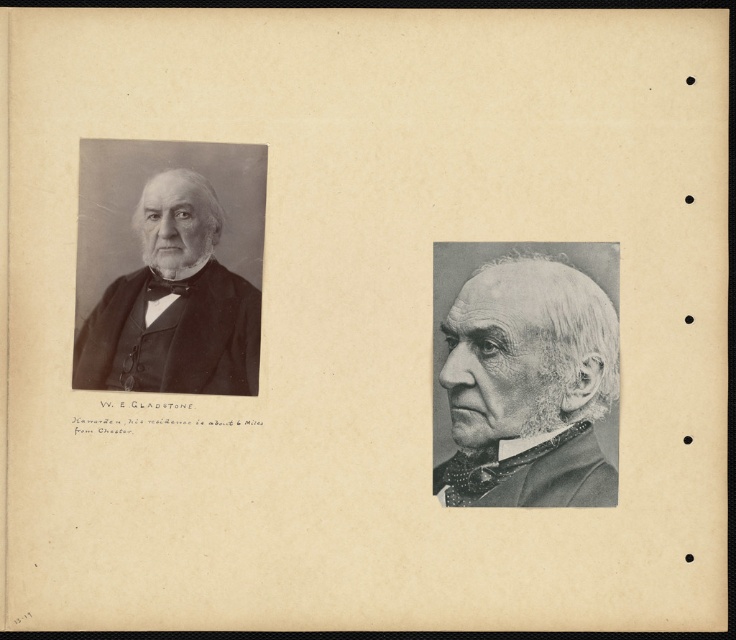
Question: Is gray matte suit at center positioned before matte black bow tie at left?

Choices:
 (A) no
 (B) yes

Answer: (B)

Question: Which point is farther to the camera?

Choices:
 (A) (149, 228)
 (B) (452, 381)

Answer: (A)

Question: Is gray matte suit at center below matte black bow tie at left?

Choices:
 (A) no
 (B) yes

Answer: (B)

Question: Does gray matte suit at center have a larger size compared to matte black bow tie at left?

Choices:
 (A) yes
 (B) no

Answer: (A)